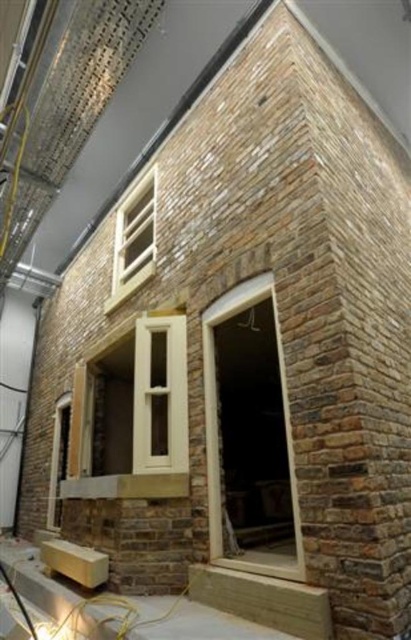
You are an architect designing a new building and want to ensure proper spacing between the smooth cream window at center and the white wood window at upper center. According to the image, which window has a smaller width?

The smooth cream window at center has a lesser width compared to the white wood window at upper center, so the smooth cream window at center is narrower.

You are an architect examining the brick building under construction. You see the smooth cream window at center and the white wood window at upper center. Which window is located to the right of the other?

The smooth cream window at center is positioned on the right side of white wood window at upper center.

You are a painter standing on a ladder. You need to paint the white plastic window at center and the white wood window at upper center. The ladder you are using can only reach up to 1.5 meters. Can you paint both windows without moving the ladder?

The distance between the white plastic window at center and the white wood window at upper center is 1.66 meters, which exceeds the ladder height of 1.5 meters. Therefore, you will need to move the ladder to reach both windows.